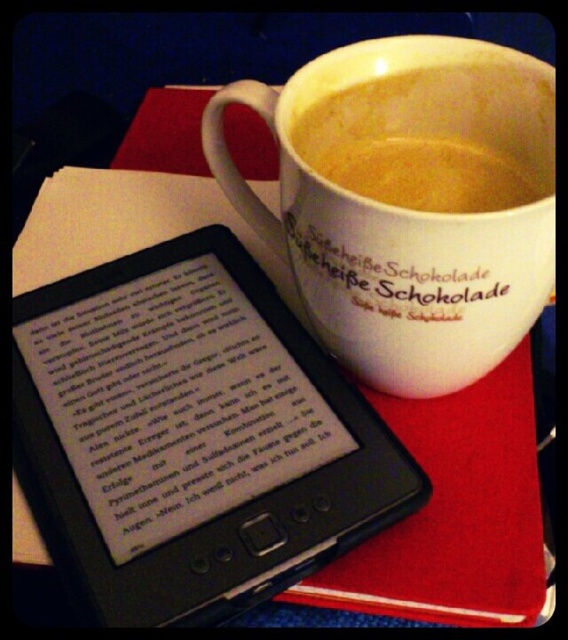
You are organizing a small desk space and need to place both the black matte tablet computer at upper left and the white matte cup of coffee at upper center. Given their sizes, which object requires more horizontal space on the desk?

The black matte tablet computer at upper left requires more horizontal space on the desk because its width surpasses that of the white matte cup of coffee at upper center.